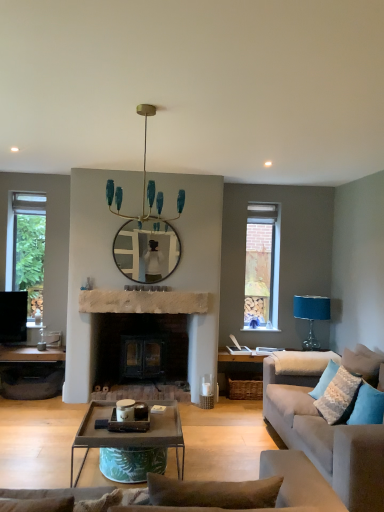
Locate an element on the screen. The width and height of the screenshot is (384, 512). matte glass mirror at center is located at coordinates (147, 251).

This screenshot has width=384, height=512. In order to click on metallic silver tray at lower left in this screenshot , I will do `click(31, 372)`.

What is the approximate width of metallic gray coffee table at center?

34.24 inches.

Measure the distance between textured blue pillow at right, which is the 1th pillow from back to front, and camera.

textured blue pillow at right, which is the 1th pillow from back to front, and camera are 3.29 meters apart from each other.

In order to click on textured blue pillow at right, the second pillow viewed from the front in this screenshot , I will do `click(338, 397)`.

Locate an element on the screen. blue fabric lampshade at right is located at coordinates [311, 315].

Identify the location of blue fabric pillow at lower right, marked as the first pillow in a front-to-back arrangement. The image size is (384, 512). (367, 406).

Considering their positions, is textured blue pillow at right, the second pillow viewed from the front, located in front of or behind metallic gray coffee table at center?

textured blue pillow at right, the second pillow viewed from the front, is positioned farther from the viewer than metallic gray coffee table at center.

Looking at their sizes, would you say textured blue pillow at right, which is the 1th pillow from back to front, is wider or thinner than metallic gray coffee table at center?

In the image, textured blue pillow at right, which is the 1th pillow from back to front, appears to be more narrow than metallic gray coffee table at center.

Is point (354, 395) less distant than point (126, 435)?

No.

Is metallic gray coffee table at center located within textured blue pillow at right, the second pillow viewed from the front?

No, textured blue pillow at right, the second pillow viewed from the front, does not contain metallic gray coffee table at center.

Is teal glass chandelier at upper center in front of light gray fabric couch at right?

Yes, it is in front of light gray fabric couch at right.

Based on the photo, is teal glass chandelier at upper center wider than light gray fabric couch at right?

No.

Is teal glass chandelier at upper center turned away from light gray fabric couch at right?

No, teal glass chandelier at upper center's orientation is not away from light gray fabric couch at right.

Image resolution: width=384 pixels, height=512 pixels. I want to click on studio couch that is under the teal glass chandelier at upper center (from a real-world perspective), so click(326, 440).

Is matte glass mirror at center far from light gray fabric couch at right?

Yes, matte glass mirror at center and light gray fabric couch at right are quite far apart.

Is matte glass mirror at center taller or shorter than light gray fabric couch at right?

matte glass mirror at center is shorter than light gray fabric couch at right.

From the image's perspective, is matte glass mirror at center beneath light gray fabric couch at right?

No, from the image's perspective, matte glass mirror at center is not below light gray fabric couch at right.

Is point (136, 232) farther from viewer compared to point (354, 426)?

Yes, it is.

Considering the relative sizes of light gray fabric couch at right and teal glass chandelier at upper center in the image provided, is light gray fabric couch at right smaller than teal glass chandelier at upper center?

No, light gray fabric couch at right is not smaller than teal glass chandelier at upper center.

From a real-world perspective, which is physically below, light gray fabric couch at right or teal glass chandelier at upper center?

light gray fabric couch at right is physically lower.

Does light gray fabric couch at right appear on the left side of teal glass chandelier at upper center?

No, light gray fabric couch at right is not to the left of teal glass chandelier at upper center.

Is teal glass chandelier at upper center at the back of light gray fabric couch at right?

No, light gray fabric couch at right's orientation is not away from teal glass chandelier at upper center.

Would you say matte glass mirror at center is a long distance from teal glass chandelier at upper center?

They are positioned close to each other.

Who is shorter, matte glass mirror at center or teal glass chandelier at upper center?

Standing shorter between the two is teal glass chandelier at upper center.

From the image's perspective, is matte glass mirror at center located above teal glass chandelier at upper center?

No, from the image's perspective, matte glass mirror at center is not on top of teal glass chandelier at upper center.

From a real-world perspective, between light gray fabric couch at right and textured blue pillow at right, the second pillow viewed from the front, who is vertically higher?

textured blue pillow at right, the second pillow viewed from the front, from a real-world perspective.

In the scene shown: Is textured blue pillow at right, the second pillow viewed from the front, a part of light gray fabric couch at right?

Yes, textured blue pillow at right, the second pillow viewed from the front, is a part of light gray fabric couch at right.

Considering the points (363, 496) and (335, 369), which point is behind, point (363, 496) or point (335, 369)?

The point (335, 369) is farther.

I want to click on the 2nd pillow positioned above the light gray fabric couch at right (from a real-world perspective), so click(x=338, y=397).

From a real-world perspective, does metallic silver tray at lower left sit lower than teal glass chandelier at upper center?

Yes, from a real-world perspective, metallic silver tray at lower left is beneath teal glass chandelier at upper center.

In the scene shown: Does metallic silver tray at lower left have a greater height compared to teal glass chandelier at upper center?

No, metallic silver tray at lower left is not taller than teal glass chandelier at upper center.

Is metallic silver tray at lower left positioned behind teal glass chandelier at upper center?

Yes, it is behind teal glass chandelier at upper center.

This screenshot has width=384, height=512. What are the coordinates of `light fixture above the metallic silver tray at lower left (from a real-world perspective)` in the screenshot? It's located at (143, 185).

The width and height of the screenshot is (384, 512). In the image, there is a textured blue pillow at right, which is the 1th pillow from back to front. What are the coordinates of `coffee table below it (from a real-world perspective)` in the screenshot? It's located at (131, 433).

You are a GUI agent. You are given a task and a screenshot of the screen. Output one action in this format:
    pyautogui.click(x=<x>, y=<y>)
    Task: Click on the light fixture in front of the light gray fabric couch at right
    This screenshot has width=384, height=512.
    Given the screenshot: What is the action you would take?
    (143, 185)

From the image, which object appears to be farther from matte glass mirror at center, metallic gray coffee table at center or light gray fabric couch at right?

light gray fabric couch at right is further to matte glass mirror at center.

Looking at the image, which one is located further to blue fabric lampshade at right, light gray fabric couch at right or blue fabric pillow at lower right, marked as the first pillow in a front-to-back arrangement?

blue fabric pillow at lower right, marked as the first pillow in a front-to-back arrangement, is further to blue fabric lampshade at right.

Considering their positions, is matte glass mirror at center positioned further to teal glass chandelier at upper center than metallic gray coffee table at center?

metallic gray coffee table at center.

Consider the image. When comparing their distances from textured blue pillow at right, which is the 1th pillow from back to front, does light gray fabric couch at right or teal glass chandelier at upper center seem closer?

The object closer to textured blue pillow at right, which is the 1th pillow from back to front, is light gray fabric couch at right.

Looking at the image, which one is located closer to blue fabric lampshade at right, blue fabric pillow at lower right, marked as the first pillow in a front-to-back arrangement, or matte glass mirror at center?

matte glass mirror at center is positioned closer to the anchor blue fabric lampshade at right.

From the picture: Looking at the image, which one is located further to metallic gray coffee table at center, matte glass mirror at center or blue fabric pillow at lower right, placed as the 2th pillow when sorted from back to front?

matte glass mirror at center.

Which object lies nearer to the anchor point matte glass mirror at center, blue fabric lampshade at right or teal glass chandelier at upper center?

teal glass chandelier at upper center is closer to matte glass mirror at center.

Based on their spatial positions, is teal glass chandelier at upper center or metallic gray coffee table at center closer to metallic silver tray at lower left?

The object closer to metallic silver tray at lower left is metallic gray coffee table at center.

Identify the location of mirror between metallic silver tray at lower left and blue fabric lampshade at right from left to right. (147, 251).

Locate an element on the screen. This screenshot has height=512, width=384. coffee table between light gray fabric couch at right and matte glass mirror at center along the z-axis is located at coordinates (131, 433).

You are a GUI agent. You are given a task and a screenshot of the screen. Output one action in this format:
    pyautogui.click(x=<x>, y=<y>)
    Task: Click on the coffee table positioned between teal glass chandelier at upper center and metallic silver tray at lower left from near to far
    This screenshot has width=384, height=512.
    Given the screenshot: What is the action you would take?
    pyautogui.click(x=131, y=433)

Locate an element on the screen. The height and width of the screenshot is (512, 384). pillow between metallic gray coffee table at center and blue fabric pillow at lower right, placed as the 2th pillow when sorted from back to front, in the horizontal direction is located at coordinates (338, 397).